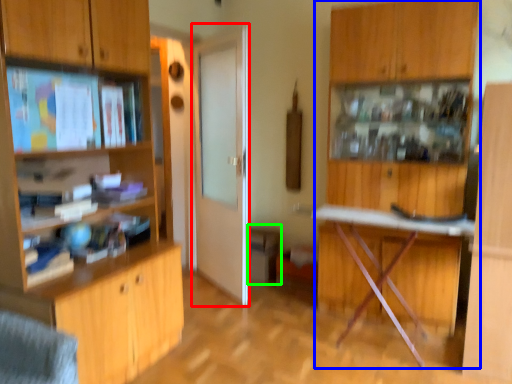
Question: Based on their relative distances, which object is nearer to door (highlighted by a red box)? Choose from dresser (highlighted by a blue box) and cabinetry (highlighted by a green box).

Choices:
 (A) dresser
 (B) cabinetry

Answer: (B)